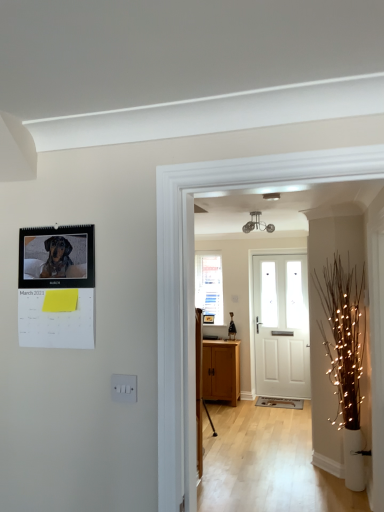
Where is `illuminated twig at right`? illuminated twig at right is located at coordinates (343, 336).

The width and height of the screenshot is (384, 512). Identify the location of white painted wood door at center. (281, 326).

Is wooden cabinet at center facing away from white painted wood door at center?

No, wooden cabinet at center is not facing the opposite direction of white painted wood door at center.

How distant is wooden cabinet at center from white painted wood door at center?

wooden cabinet at center is 31.09 inches away from white painted wood door at center.

Considering the relative sizes of wooden cabinet at center and white painted wood door at center in the image provided, is wooden cabinet at center smaller than white painted wood door at center?

Incorrect, wooden cabinet at center is not smaller in size than white painted wood door at center.

Considering the relative positions of wooden cabinet at center and white painted wood door at center in the image provided, is wooden cabinet at center to the right of white painted wood door at center from the viewer's perspective?

In fact, wooden cabinet at center is to the left of white painted wood door at center.

Is wooden cabinet at center next to clear glass window at center?

They are not placed beside each other.

Can you tell me how much wooden cabinet at center and clear glass window at center differ in facing direction?

wooden cabinet at center and clear glass window at center are facing 0.0484 degrees away from each other.

Is wooden cabinet at center looking in the opposite direction of clear glass window at center?

No, wooden cabinet at center is not facing the opposite direction of clear glass window at center.

Is wooden cabinet at center situated inside clear glass window at center or outside?

wooden cabinet at center is outside clear glass window at center.

Where is `christmas light on the right of wooden cabinet at center`? christmas light on the right of wooden cabinet at center is located at coordinates (343, 336).

Would you say illuminated twig at right is outside wooden cabinet at center?

Yes.

Based on the photo, from a real-world perspective, is illuminated twig at right physically located above or below wooden cabinet at center?

illuminated twig at right is above wooden cabinet at center.

From the image's perspective, would you say illuminated twig at right is shown under wooden cabinet at center?

No, from the image's perspective, illuminated twig at right is not beneath wooden cabinet at center.

Is clear glass window at center to the left or to the right of wooden cabinet at center in the image?

clear glass window at center is to the left of wooden cabinet at center.

The width and height of the screenshot is (384, 512). There is a wooden cabinet at center. Find the location of `window above it (from a real-world perspective)`. window above it (from a real-world perspective) is located at coordinates (209, 285).

Does clear glass window at center have a larger size compared to wooden cabinet at center?

Actually, clear glass window at center might be smaller than wooden cabinet at center.

From the picture: Is clear glass window at center oriented towards wooden cabinet at center?

No.

Is white painted wood door at center with wooden cabinet at center?

They are not placed beside each other.

How many degrees apart are the facing directions of white painted wood door at center and wooden cabinet at center?

0.763 degrees separate the facing orientations of white painted wood door at center and wooden cabinet at center.

Is point (258, 272) less distant than point (208, 346)?

No, it is behind (208, 346).

Between white painted wood door at center and wooden cabinet at center, which one has smaller width?

white painted wood door at center is thinner.

Is illuminated twig at right oriented away from clear glass window at center?

No, illuminated twig at right's orientation is not away from clear glass window at center.

Between illuminated twig at right and clear glass window at center, which one has larger width?

Wider between the two is illuminated twig at right.

Which of these two, illuminated twig at right or clear glass window at center, is smaller?

clear glass window at center.

Where is `christmas light lying on the left of white painted wood door at center`? This screenshot has width=384, height=512. christmas light lying on the left of white painted wood door at center is located at coordinates (343, 336).

Is illuminated twig at right to the left or to the right of white painted wood door at center in the image?

illuminated twig at right is positioned on white painted wood door at center's left side.

From a real-world perspective, which object rests below the other?

illuminated twig at right, from a real-world perspective.

Who is bigger, illuminated twig at right or white painted wood door at center?

Bigger between the two is illuminated twig at right.

The image size is (384, 512). What are the coordinates of `cabinetry located below the white painted wood door at center (from the image's perspective)` in the screenshot? It's located at (221, 371).

Find the location of a particular element. cabinetry on the right of the clear glass window at center is located at coordinates (221, 371).

In the scene shown: When comparing their distances from illuminated twig at right, does clear glass window at center or wooden cabinet at center seem closer?

Among the two, wooden cabinet at center is located nearer to illuminated twig at right.

Looking at the image, which one is located further to clear glass window at center, wooden cabinet at center or white painted wood door at center?

wooden cabinet at center lies further to clear glass window at center than the other object.

Estimate the real-world distances between objects in this image. Which object is closer to wooden cabinet at center, white painted wood door at center or clear glass window at center?

Based on the image, white painted wood door at center appears to be nearer to wooden cabinet at center.

Looking at the image, which one is located closer to white painted wood door at center, illuminated twig at right or wooden cabinet at center?

wooden cabinet at center is positioned closer to the anchor white painted wood door at center.

Looking at the image, which one is located closer to clear glass window at center, white painted wood door at center or wooden cabinet at center?

white painted wood door at center lies closer to clear glass window at center than the other object.

Estimate the real-world distances between objects in this image. Which object is further from white painted wood door at center, illuminated twig at right or clear glass window at center?

illuminated twig at right lies further to white painted wood door at center than the other object.

From the image, which object appears to be farther from illuminated twig at right, white painted wood door at center or wooden cabinet at center?

white painted wood door at center is further to illuminated twig at right.

Based on the photo, estimate the real-world distances between objects in this image. Which object is further from wooden cabinet at center, clear glass window at center or white painted wood door at center?

clear glass window at center is positioned further to the anchor wooden cabinet at center.

Locate an element on the screen. This screenshot has width=384, height=512. cabinetry between illuminated twig at right and white painted wood door at center from front to back is located at coordinates (221, 371).

You are a GUI agent. You are given a task and a screenshot of the screen. Output one action in this format:
    pyautogui.click(x=<x>, y=<y>)
    Task: Click on the cabinetry located between illuminated twig at right and clear glass window at center in the depth direction
    The image size is (384, 512).
    Given the screenshot: What is the action you would take?
    pyautogui.click(x=221, y=371)

I want to click on door between illuminated twig at right and clear glass window at center along the z-axis, so click(x=281, y=326).

Locate an element on the screen. The width and height of the screenshot is (384, 512). door between clear glass window at center and wooden cabinet at center from top to bottom is located at coordinates click(x=281, y=326).